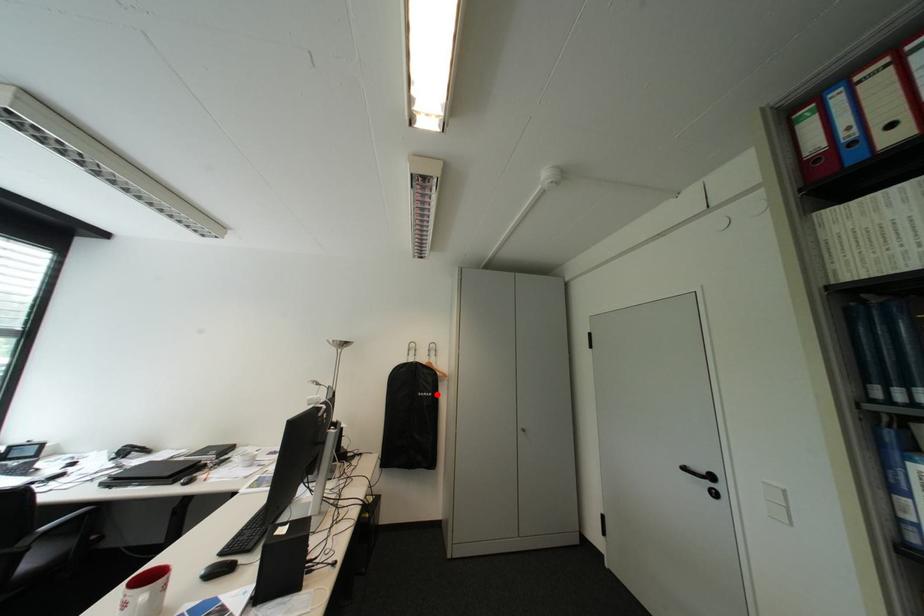
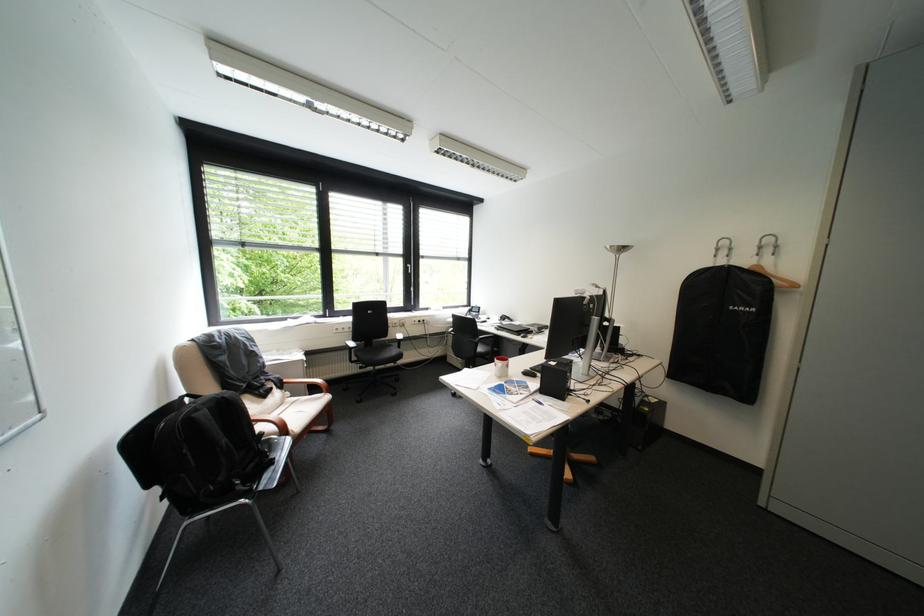
In the second image, find the point that corresponds to the highlighted location in the first image.

(755, 309)